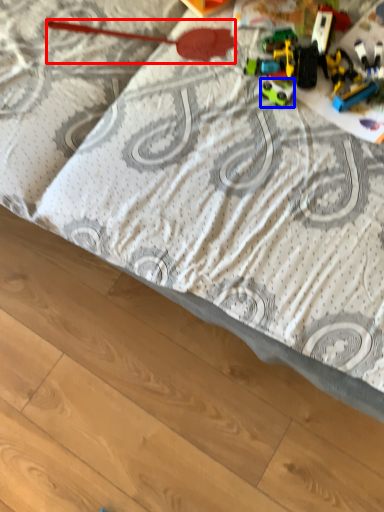
Question: Which object is further to the camera taking this photo, toy (highlighted by a red box) or toy (highlighted by a blue box)?

Choices:
 (A) toy
 (B) toy

Answer: (A)